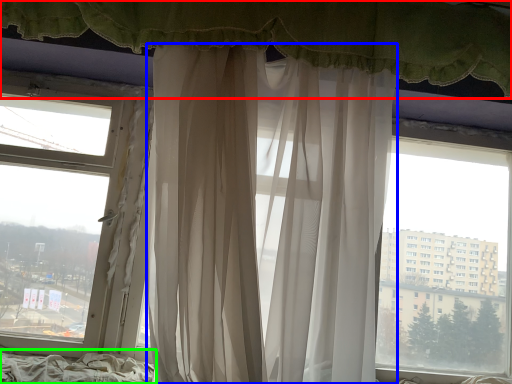
Question: Which object is the closest to the curtain (highlighted by a red box)? Choose among these: curtain (highlighted by a blue box) or bed frame (highlighted by a green box).

Choices:
 (A) curtain
 (B) bed frame

Answer: (A)